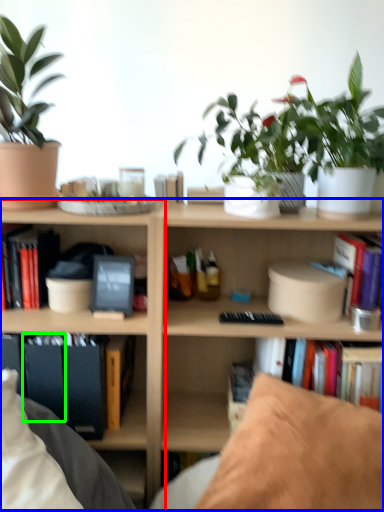
Question: Which object is the closest to the shelf (highlighted by a red box)? Choose among these: bookcase (highlighted by a blue box) or paperback book (highlighted by a green box).

Choices:
 (A) bookcase
 (B) paperback book

Answer: (A)